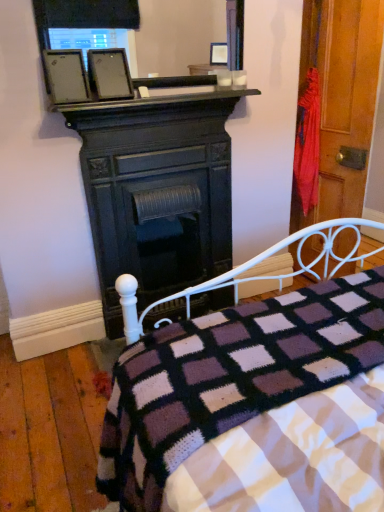
Question: In the image, is matte black picture frame at upper center on the left side or the right side of wooden door at right?

Choices:
 (A) left
 (B) right

Answer: (A)

Question: From the image's perspective, relative to wooden door at right, is matte black picture frame at upper center above or below?

Choices:
 (A) above
 (B) below

Answer: (A)

Question: Estimate the real-world distances between objects in this image. Which object is farther from the matte black fireplace at center?

Choices:
 (A) matte black picture frame at upper center
 (B) wooden door at right
 (C) black matte fireplace at upper center
 (D) black glass mirror at upper center
 (E) knitted woolen blanket at lower center

Answer: (E)

Question: Estimate the real-world distances between objects in this image. Which object is closer to the black glass mirror at upper center?

Choices:
 (A) matte black picture frame at upper center
 (B) knitted woolen blanket at lower center
 (C) wooden door at right
 (D) matte black fireplace at center
 (E) black matte fireplace at upper center

Answer: (A)